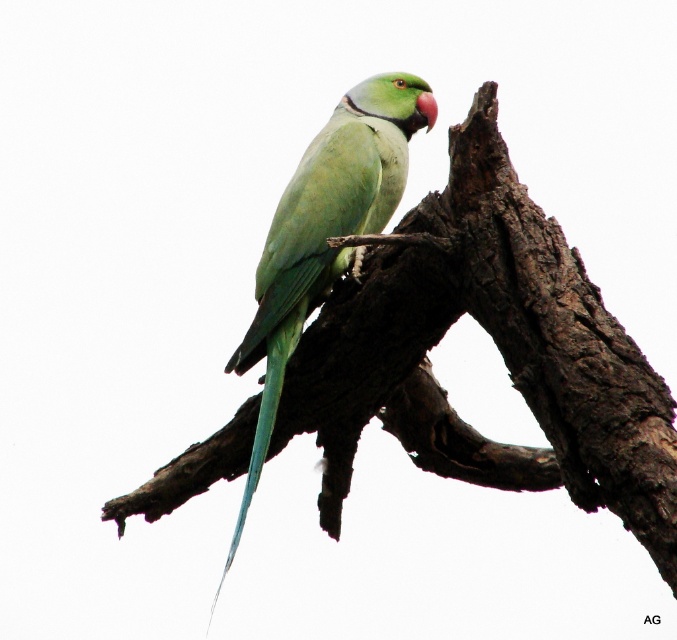
Which is below, green matte tree branch at center or green matte parrot at center?

Positioned lower is green matte tree branch at center.

Find the location of `green matte tree branch at center`. green matte tree branch at center is located at coordinates (496, 346).